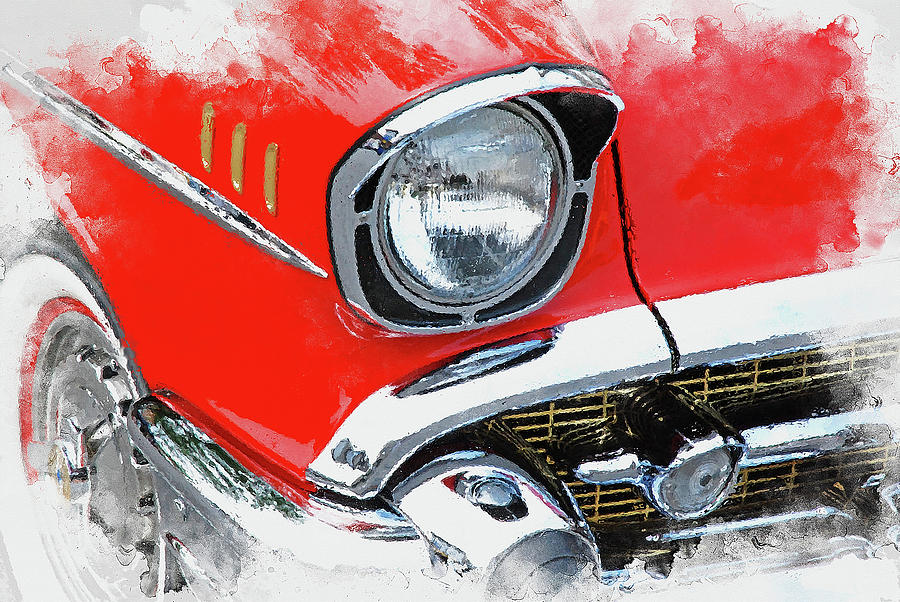
Locate an element on the screen. hood is located at coordinates (753, 173).